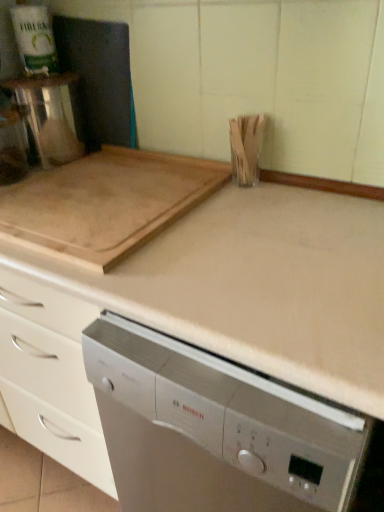
In order to face satin silver dishwasher at center, should I rotate leftwards or rightwards?

To align with it, rotate right about 10.279°.

Identify the location of satin silver dishwasher at center. This screenshot has width=384, height=512. (214, 429).

Describe the element at coordinates (214, 429) in the screenshot. I see `satin silver dishwasher at center` at that location.

Describe the element at coordinates (105, 203) in the screenshot. The width and height of the screenshot is (384, 512). I see `natural wood cutting board at upper left` at that location.

You are a GUI agent. You are given a task and a screenshot of the screen. Output one action in this format:
    pyautogui.click(x=<x>, y=<y>)
    Task: Click on the natural wood cutting board at upper left
    This screenshot has height=512, width=384.
    Given the screenshot: What is the action you would take?
    pyautogui.click(x=105, y=203)

Where is `satin silver dishwasher at center`? Image resolution: width=384 pixels, height=512 pixels. satin silver dishwasher at center is located at coordinates (214, 429).

Between natural wood cutting board at upper left and satin silver dishwasher at center, which one appears on the right side from the viewer's perspective?

Positioned to the right is satin silver dishwasher at center.

Is natural wood cutting board at upper left further to camera compared to satin silver dishwasher at center?

Yes, it is behind satin silver dishwasher at center.

Consider the image. Which is farther from the camera, (20, 234) or (237, 507)?

The point (20, 234) is farther.

From the image's perspective, between natural wood cutting board at upper left and satin silver dishwasher at center, who is located below?

satin silver dishwasher at center is shown below in the image.

From a real-world perspective, between natural wood cutting board at upper left and satin silver dishwasher at center, who is vertically higher?

natural wood cutting board at upper left, from a real-world perspective.

Is natural wood cutting board at upper left wider or thinner than satin silver dishwasher at center?

natural wood cutting board at upper left is thinner than satin silver dishwasher at center.

Looking at this image, considering the sizes of objects natural wood cutting board at upper left and satin silver dishwasher at center in the image provided, who is taller, natural wood cutting board at upper left or satin silver dishwasher at center?

Standing taller between the two is satin silver dishwasher at center.

Considering the relative sizes of natural wood cutting board at upper left and satin silver dishwasher at center in the image provided, is natural wood cutting board at upper left bigger than satin silver dishwasher at center?

No.

Does natural wood cutting board at upper left contain satin silver dishwasher at center?

Definitely not — satin silver dishwasher at center is not inside natural wood cutting board at upper left.

Is natural wood cutting board at upper left far away from satin silver dishwasher at center?

natural wood cutting board at upper left is actually quite close to satin silver dishwasher at center.

Is natural wood cutting board at upper left looking in the opposite direction of satin silver dishwasher at center?

That's not correct — natural wood cutting board at upper left is not looking away from satin silver dishwasher at center.

How much distance is there between natural wood cutting board at upper left and satin silver dishwasher at center?

A distance of 14.28 inches exists between natural wood cutting board at upper left and satin silver dishwasher at center.

The image size is (384, 512). I want to click on kitchen appliance above the satin silver dishwasher at center (from a real-world perspective), so click(105, 203).

Can you confirm if satin silver dishwasher at center is positioned to the left of natural wood cutting board at upper left?

No, satin silver dishwasher at center is not to the left of natural wood cutting board at upper left.

Which is in front, satin silver dishwasher at center or natural wood cutting board at upper left?

satin silver dishwasher at center.

Is point (187, 435) positioned in front of point (93, 191)?

Yes, it is in front of point (93, 191).

From the picture: From the image's perspective, is satin silver dishwasher at center over natural wood cutting board at upper left?

No, from the image's perspective, satin silver dishwasher at center is not over natural wood cutting board at upper left.

From a real-world perspective, is satin silver dishwasher at center above or below natural wood cutting board at upper left?

Clearly, from a real-world perspective, satin silver dishwasher at center is below natural wood cutting board at upper left.

Which of these two, satin silver dishwasher at center or natural wood cutting board at upper left, is wider?

Wider between the two is satin silver dishwasher at center.

Is satin silver dishwasher at center shorter than natural wood cutting board at upper left?

No.

In terms of size, does satin silver dishwasher at center appear bigger or smaller than natural wood cutting board at upper left?

satin silver dishwasher at center is bigger than natural wood cutting board at upper left.

Would you say satin silver dishwasher at center is outside natural wood cutting board at upper left?

Yes, satin silver dishwasher at center is outside of natural wood cutting board at upper left.

Is there a large distance between satin silver dishwasher at center and natural wood cutting board at upper left?

No.

Does satin silver dishwasher at center turn towards natural wood cutting board at upper left?

No, satin silver dishwasher at center is not aimed at natural wood cutting board at upper left.

Measure the distance from satin silver dishwasher at center to natural wood cutting board at upper left.

A distance of 14.28 inches exists between satin silver dishwasher at center and natural wood cutting board at upper left.

The height and width of the screenshot is (512, 384). I want to click on home appliance located underneath the natural wood cutting board at upper left (from a real-world perspective), so click(x=214, y=429).

Locate an element on the screen. kitchen appliance above the satin silver dishwasher at center (from the image's perspective) is located at coordinates (105, 203).

Find the location of a particular element. This screenshot has height=512, width=384. home appliance on the right of natural wood cutting board at upper left is located at coordinates (214, 429).